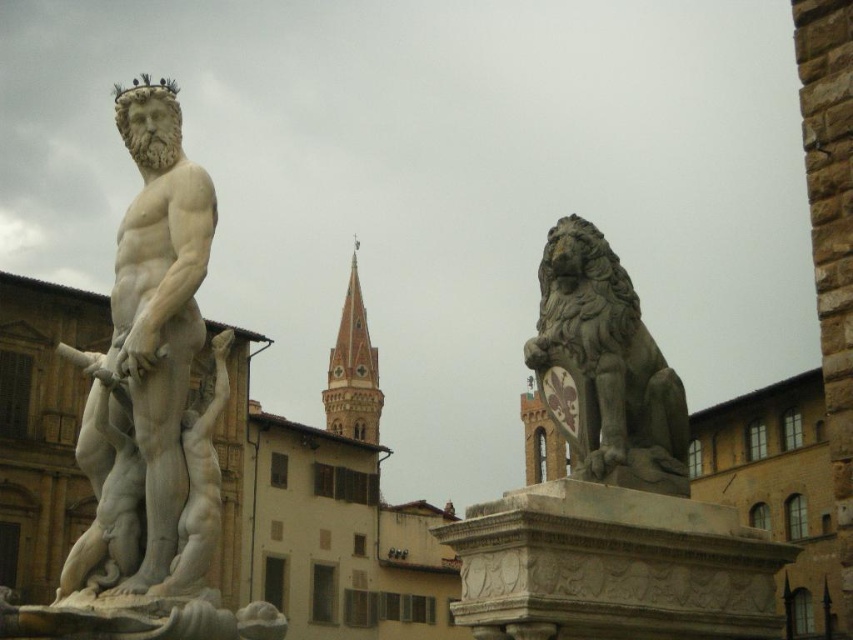
Can you confirm if white marble statue at center is thinner than gold metallic crown at upper center?

No.

Does white marble statue at center lie in front of gold metallic crown at upper center?

Yes, white marble statue at center is closer to the viewer.

Is point (115, 353) less distant than point (117, 92)?

That is True.

Where is `white marble statue at center`? The image size is (853, 640). white marble statue at center is located at coordinates (144, 364).

Describe the element at coordinates (144, 364) in the screenshot. This screenshot has width=853, height=640. I see `white marble statue at center` at that location.

Between point (209, 237) and point (659, 360), which one is positioned in front?

Point (209, 237) is in front.

Which is behind, point (96, 388) or point (578, 330)?

Positioned behind is point (578, 330).

The image size is (853, 640). I want to click on white marble statue at center, so click(x=144, y=364).

Is polished stone lion at right to the left of gold metallic crown at upper center from the viewer's perspective?

Incorrect, polished stone lion at right is not on the left side of gold metallic crown at upper center.

Is polished stone lion at right shorter than gold metallic crown at upper center?

In fact, polished stone lion at right may be taller than gold metallic crown at upper center.

Describe the element at coordinates (605, 368) in the screenshot. I see `polished stone lion at right` at that location.

The width and height of the screenshot is (853, 640). Find the location of `polished stone lion at right`. polished stone lion at right is located at coordinates (605, 368).